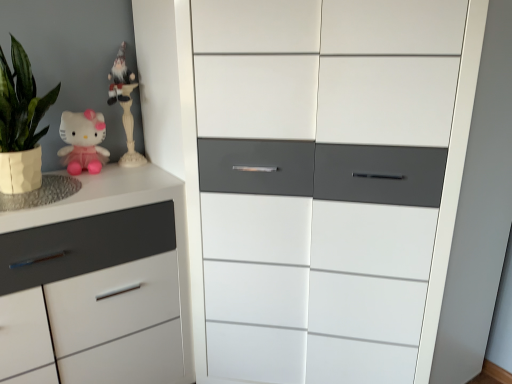
You are a GUI agent. You are given a task and a screenshot of the screen. Output one action in this format:
    pyautogui.click(x=<x>, y=<y>)
    Task: Click on the spots to the right of matte pink plush at upper left
    This screenshot has width=512, height=384.
    Given the screenshot: What is the action you would take?
    pyautogui.click(x=130, y=172)